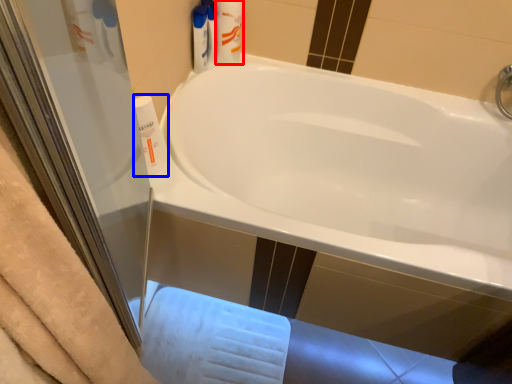
Question: Which of the following is the closest to the observer, toiletry (highlighted by a red box) or cleaning product (highlighted by a blue box)?

Choices:
 (A) toiletry
 (B) cleaning product

Answer: (B)